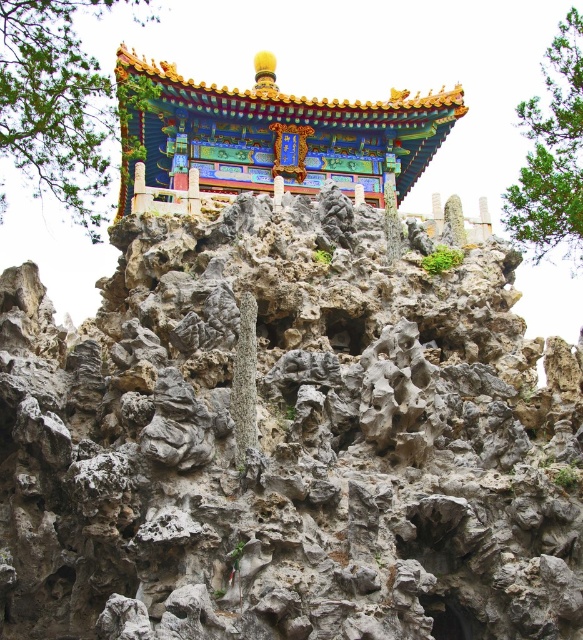
Is shiny lacquered pavilion at center above green leafy tree at upper right?

No, shiny lacquered pavilion at center is not above green leafy tree at upper right.

Is shiny lacquered pavilion at center positioned behind green leafy tree at upper right?

Yes, shiny lacquered pavilion at center is further from the viewer.

Is point (420, 100) positioned after point (563, 35)?

Yes.

In order to click on shiny lacquered pavilion at center in this screenshot , I will do `click(272, 132)`.

Based on the photo, is gray rough rock face at center taller than green leafy tree at upper right?

Incorrect, gray rough rock face at center's height is not larger of green leafy tree at upper right's.

The height and width of the screenshot is (640, 583). In order to click on gray rough rock face at center in this screenshot , I will do `click(287, 442)`.

The height and width of the screenshot is (640, 583). What do you see at coordinates (287, 442) in the screenshot? I see `gray rough rock face at center` at bounding box center [287, 442].

You are a GUI agent. You are given a task and a screenshot of the screen. Output one action in this format:
    pyautogui.click(x=<x>, y=<y>)
    Task: Click on the gray rough rock face at center
    The width and height of the screenshot is (583, 640).
    Given the screenshot: What is the action you would take?
    pyautogui.click(x=287, y=442)

Who is shorter, gray rough rock face at center or green textured tree at upper left?

With less height is gray rough rock face at center.

Can you confirm if gray rough rock face at center is thinner than green textured tree at upper left?

No.

Between point (64, 449) and point (1, 109), which one is positioned behind?

Point (1, 109)

I want to click on gray rough rock face at center, so click(x=287, y=442).